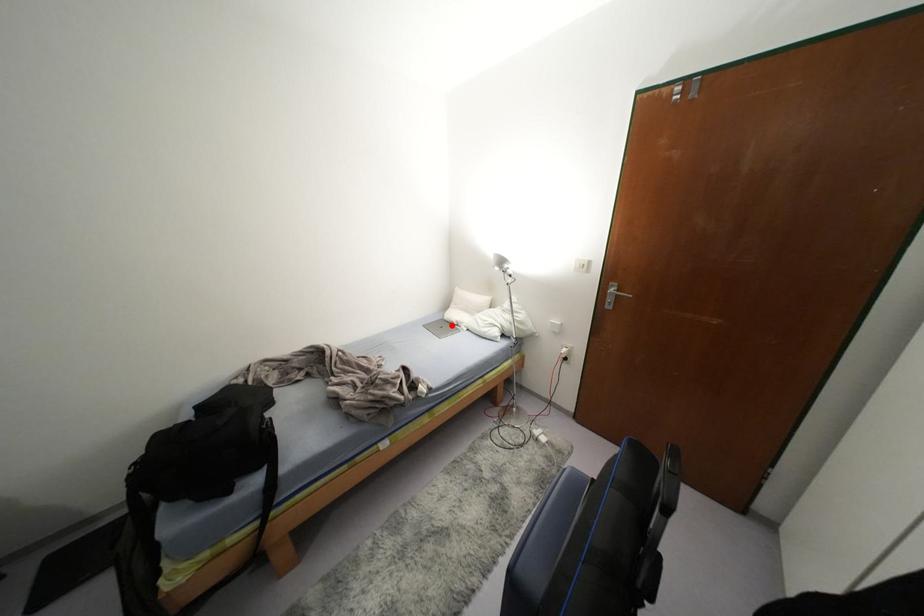
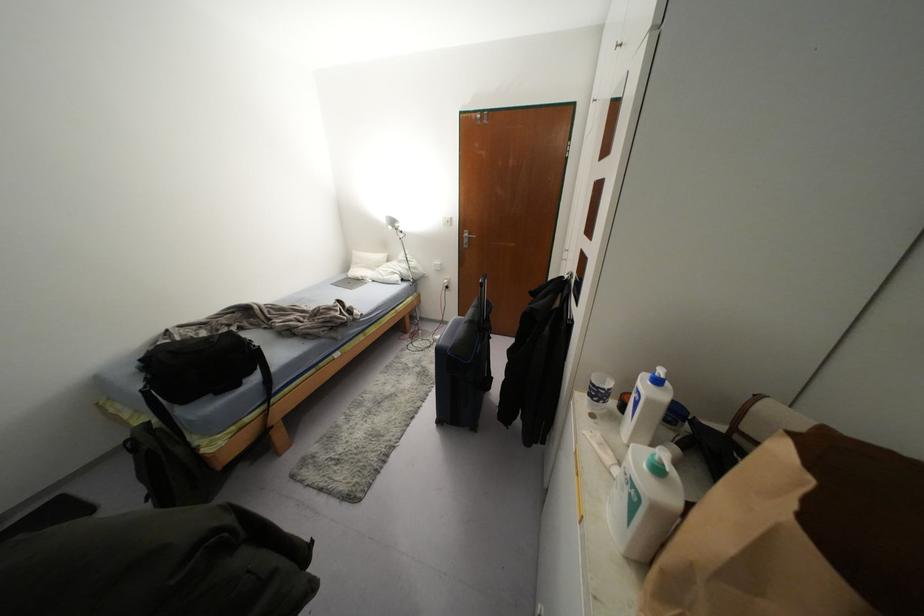
Find the pixel in the second image that matches the highlighted location in the first image.

(358, 281)